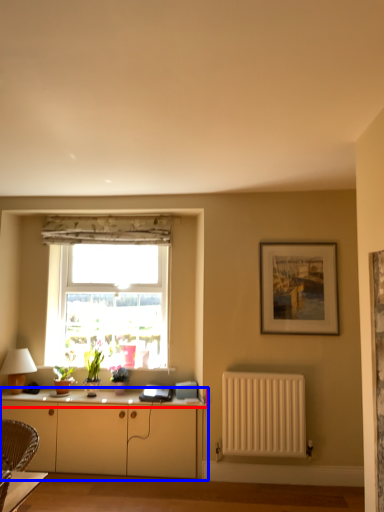
Question: Which object appears farthest to the camera in this image, counter top (highlighted by a red box) or cabinetry (highlighted by a blue box)?

Choices:
 (A) counter top
 (B) cabinetry

Answer: (A)